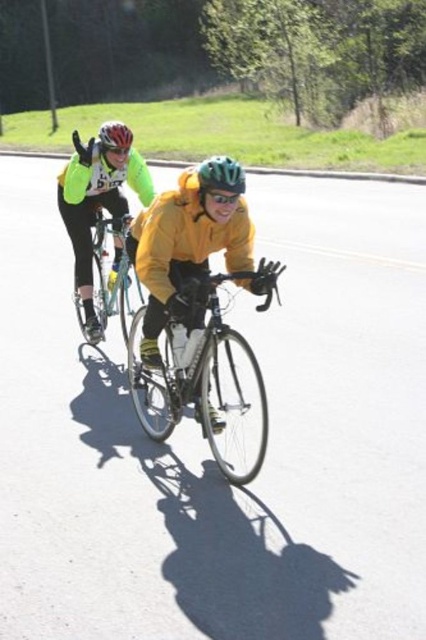
Does yellow matte jacket at center appear under green matte bicycle helmet at center?

Indeed, yellow matte jacket at center is positioned under green matte bicycle helmet at center.

Where is `yellow matte jacket at center`? The width and height of the screenshot is (426, 640). yellow matte jacket at center is located at coordinates (189, 252).

Where is `yellow matte jacket at center`? yellow matte jacket at center is located at coordinates (189, 252).

Between yellow matte jacket at center and shiny silver bicycle at center, which one appears on the left side from the viewer's perspective?

Positioned to the left is shiny silver bicycle at center.

Consider the image. Which of these two, yellow matte jacket at center or shiny silver bicycle at center, stands shorter?

shiny silver bicycle at center is shorter.

What do you see at coordinates (189, 252) in the screenshot?
I see `yellow matte jacket at center` at bounding box center [189, 252].

Image resolution: width=426 pixels, height=640 pixels. In order to click on yellow matte jacket at center in this screenshot , I will do 189,252.

Can you confirm if shiny silver bicycle at center is positioned above green matte bicycle helmet at center?

Incorrect, shiny silver bicycle at center is not positioned above green matte bicycle helmet at center.

Is the position of shiny silver bicycle at center more distant than that of green matte bicycle helmet at center?

Yes.

Measure the distance between shiny silver bicycle at center and camera.

shiny silver bicycle at center and camera are 5.95 meters apart.

I want to click on shiny silver bicycle at center, so click(x=108, y=280).